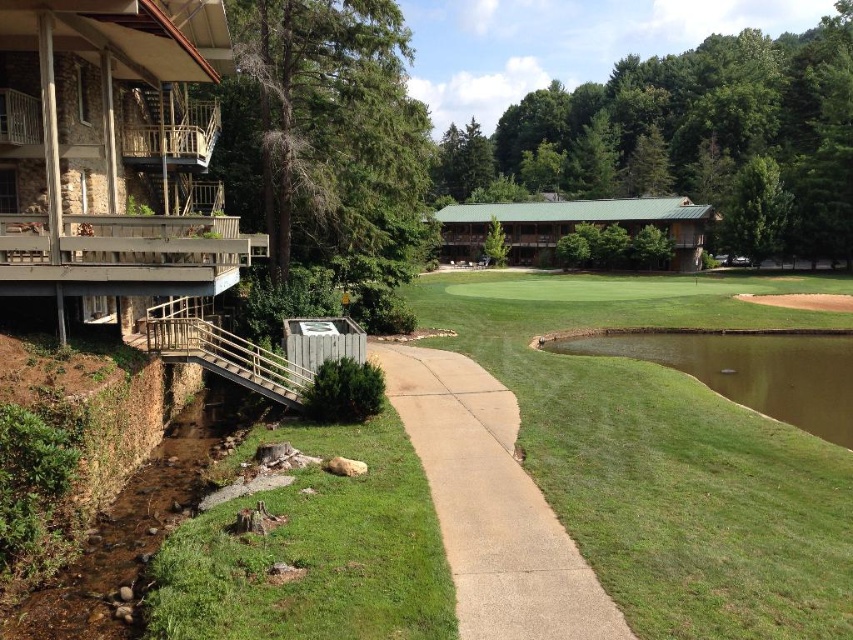
From the picture: You are standing at the resort entrance and want to head towards the green grassy golf course at center. According to the map, there is a point marked at coordinates [666,452]. Is this point located on the green grassy golf course at center?

The green grassy golf course at center is represented by the point at coordinates [666,452], so yes, the point is located on the golf course.

You are a groundskeeper responsible for maintaining the elevation levels of the green grassy golf course at center and the gray concrete sidewalk at center. Based on the scene, which area has a higher elevation?

The green grassy golf course at center has a greater height compared to the gray concrete sidewalk at center, so the golf course has a higher elevation.